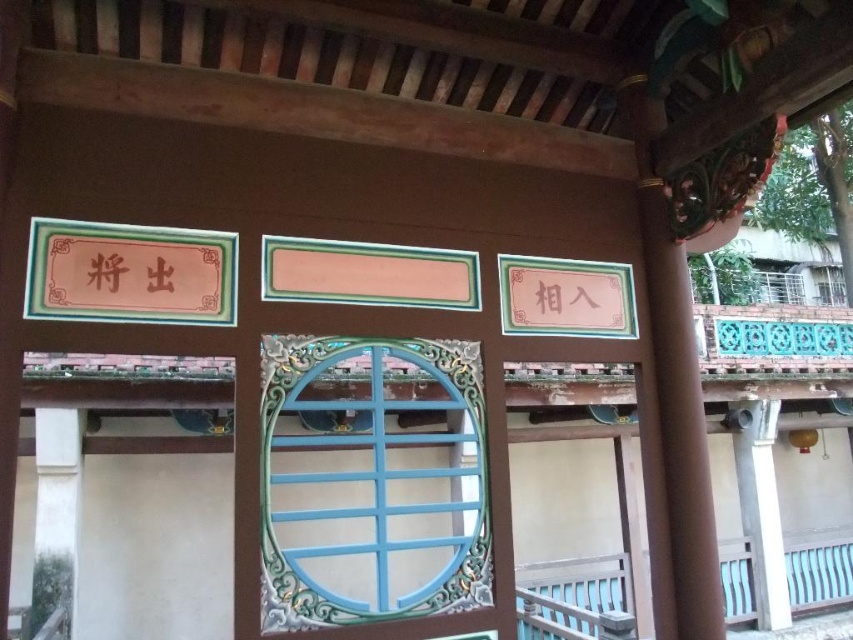
Question: Is blue painted wood window at center further to the viewer compared to white plastic balustrade at lower right?

Choices:
 (A) yes
 (B) no

Answer: (B)

Question: Which object is closer to the camera taking this photo?

Choices:
 (A) white plastic balustrade at lower right
 (B) blue painted wood window at center

Answer: (B)

Question: Which point is closer to the camera?

Choices:
 (A) white plastic balustrade at lower right
 (B) blue painted wood window at center

Answer: (B)

Question: Can you confirm if blue painted wood window at center is positioned to the left of white plastic balustrade at lower right?

Choices:
 (A) yes
 (B) no

Answer: (A)

Question: Which point is farther to the camera?

Choices:
 (A) (397, 353)
 (B) (604, 605)

Answer: (B)

Question: Does blue painted wood window at center have a smaller size compared to white plastic balustrade at lower right?

Choices:
 (A) yes
 (B) no

Answer: (B)